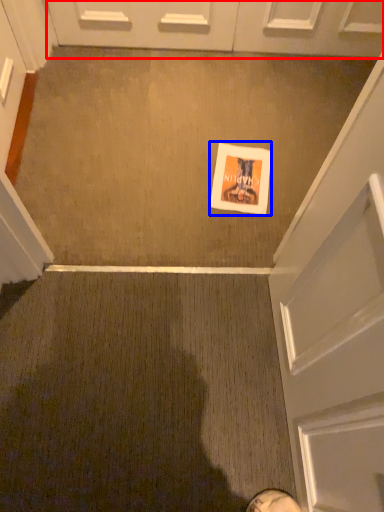
Question: Which of the following is the farthest to the observer, door (highlighted by a red box) or flyer (highlighted by a blue box)?

Choices:
 (A) door
 (B) flyer

Answer: (A)